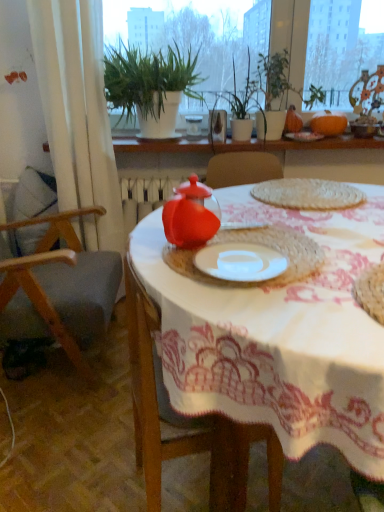
Find the location of a particular element. Image resolution: width=384 pixels, height=512 pixels. free space in front of white matte plate at center is located at coordinates (285, 309).